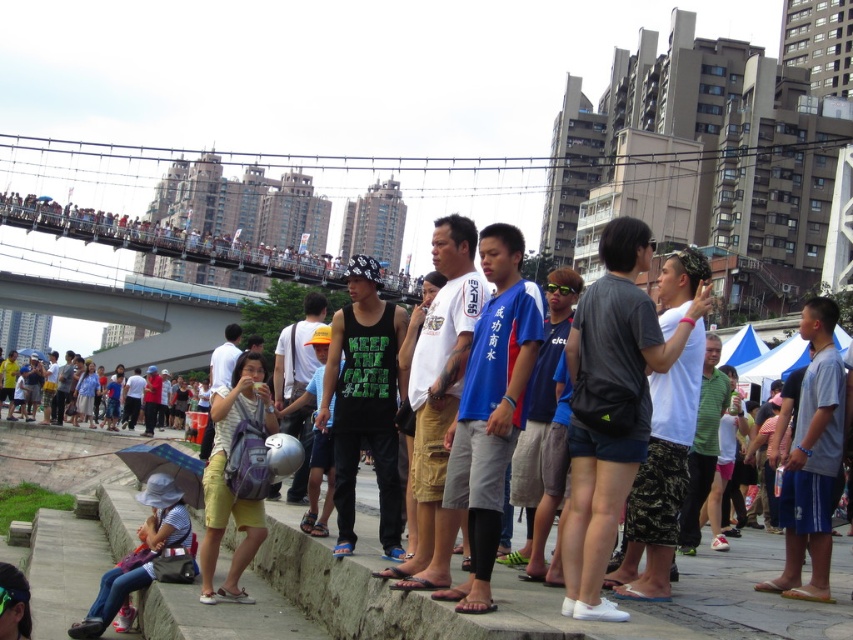
You are standing on the paved area and want to reach the suspension bridge behind the crowd. The blue fabric shirt at center and the matte black backpack at center are blocking your path. Which object should you move first to clear the path?

The blue fabric shirt at center is in front of the matte black backpack at center, so you should move the blue fabric shirt at center first to clear the path.

You are a photographer trying to capture a shot of the blue fabric shirt at center and the matte black backpack at center. From your current position, which object should you adjust your camera to focus on first if you want to include both in the frame without moving?

The blue fabric shirt at center is positioned on the right side of matte black backpack at center, so you should focus on the matte black backpack at center first to ensure both fit in the frame.